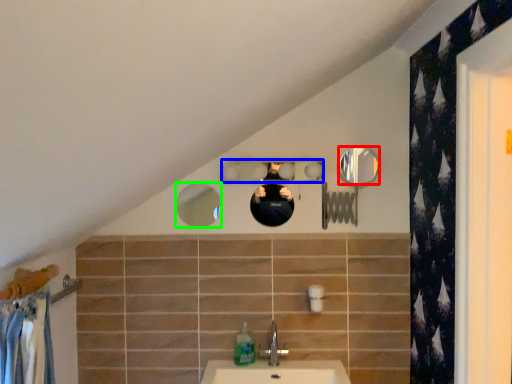
Question: Which object is the farthest from mirror (highlighted by a red box)? Choose among these: mirror (highlighted by a blue box) or mirror (highlighted by a green box).

Choices:
 (A) mirror
 (B) mirror

Answer: (B)